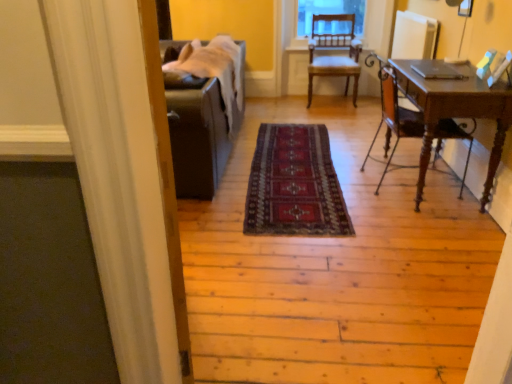
Question: From a real-world perspective, is wooden chair at center, arranged as the first chair when viewed from the back, positioned above or below dark red woven rug at center?

Choices:
 (A) above
 (B) below

Answer: (A)

Question: From the image's perspective, is wooden chair at center, which is the 2th chair in front-to-back order, positioned above or below dark red woven rug at center?

Choices:
 (A) above
 (B) below

Answer: (A)

Question: Estimate the real-world distances between objects in this image. Which object is farther from the mahogany wood desk at right, the 1th chair when ordered from bottom to top?

Choices:
 (A) dark red woven rug at center
 (B) wooden chair at center, which is the 2th chair in front-to-back order

Answer: (B)

Question: Which object is positioned closest to the dark red woven rug at center?

Choices:
 (A) wooden chair at center, which is the 2th chair in front-to-back order
 (B) mahogany wood desk at right, which is the 2th chair in top-to-bottom order

Answer: (B)